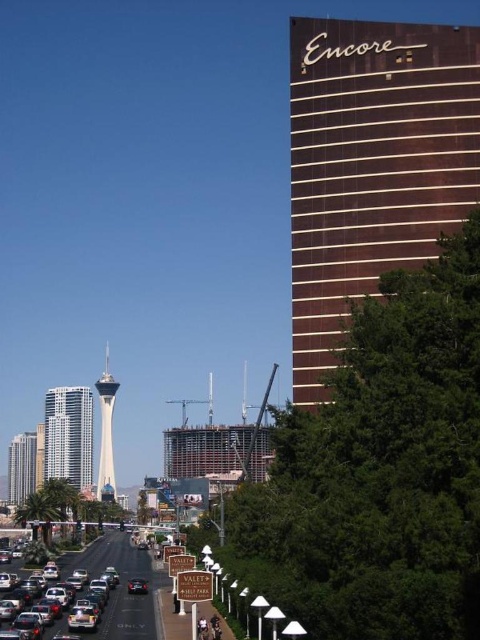
Question: Is brown polished glass tower at upper right smaller than metallic silver car at lower left?

Choices:
 (A) no
 (B) yes

Answer: (A)

Question: Which point appears farthest from the camera in this image?

Choices:
 (A) (29, 486)
 (B) (111, 593)
 (C) (71, 458)

Answer: (A)

Question: Among these points, which one is farthest from the camera?

Choices:
 (A) (101, 493)
 (B) (354, 22)
 (C) (34, 465)

Answer: (C)

Question: Estimate the real-world distances between objects in this image. Which object is closer to the shiny silver skyscraper at left?

Choices:
 (A) white glass tower at center
 (B) shiny silver car at center

Answer: (A)

Question: Does shiny metallic cars at center have a greater width compared to metallic silver car at lower left?

Choices:
 (A) yes
 (B) no

Answer: (A)

Question: Does white glass building at center appear on the left side of shiny silver car at center?

Choices:
 (A) no
 (B) yes

Answer: (B)